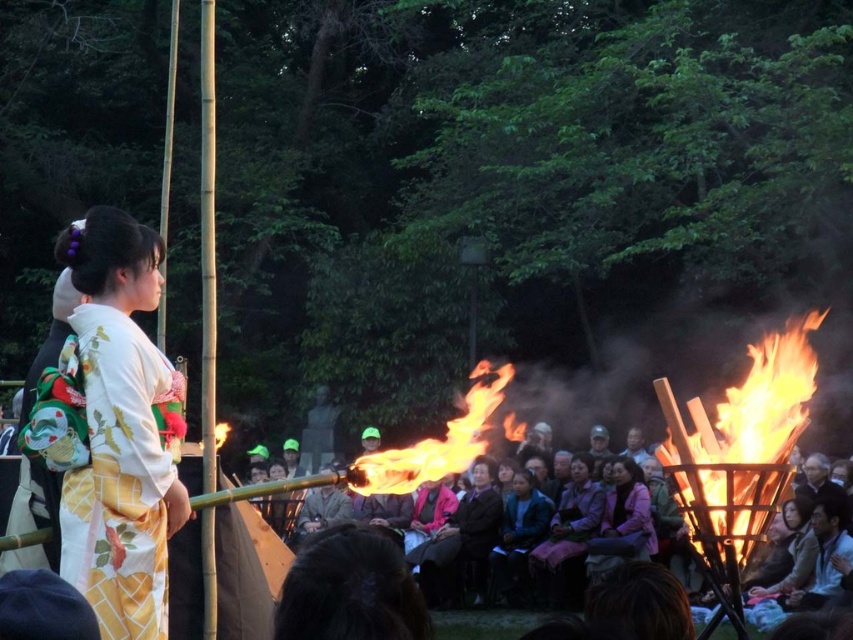
You are a photographer at the event and want to capture both the dark brown leather jacket at center and the pink fabric kimono at center in a single photo. Which object will appear lower in the photo?

The dark brown leather jacket at center will appear lower in the photo because it is positioned under the pink fabric kimono at center.

You are a photographer positioned at the center of the scene. You need to capture a photo that includes both the dark brown leather jacket at center and the large open fire pit on the right. Based on their positions, will the jacket be to the left or right of the fire pit in the photo?

The dark brown leather jacket at center is located at point (x=459, y=538), while the fire pit is on the right side of the frame. Since the jacket is at the center and the fire pit is on the right, the jacket will be to the left of the fire pit in the photo.

You are a photographer trying to capture the vibrant flames in the fire pit. You are standing at point A, which is at the center of the image. The flames are located at point B, which is at the right side of the image. There is an object at point C, which is at point (741,444). Can you determine if the object at point C is blocking your view of the flames at point B?

The object at point C is the bright orange flames at right, so it is the flames themselves. Therefore, there is no obstruction between point A and point B, meaning your view of the flames at point B is not blocked by the object at point C.